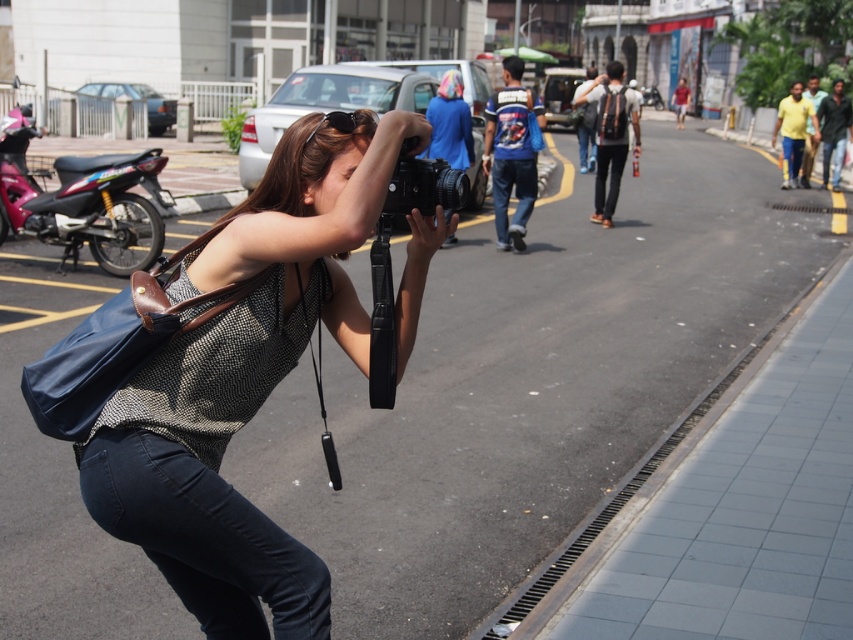
Question: Based on their relative distances, which object is farther from the black plastic sunglasses at center?

Choices:
 (A) black matte camera at center
 (B) metallic glossy motorcycle at left

Answer: (B)

Question: Which point is farther to the camera?

Choices:
 (A) black matte camera at center
 (B) black plastic sunglasses at center
 (C) matte black camera at center

Answer: (B)

Question: Is black matte camera at center thinner than black plastic sunglasses at center?

Choices:
 (A) yes
 (B) no

Answer: (B)

Question: Does black matte camera at center have a smaller size compared to black plastic sunglasses at center?

Choices:
 (A) yes
 (B) no

Answer: (B)

Question: Is black matte camera at center thinner than black plastic sunglasses at center?

Choices:
 (A) yes
 (B) no

Answer: (B)

Question: Which is farther from the black plastic sunglasses at center?

Choices:
 (A) matte black camera at center
 (B) metallic glossy motorcycle at left
 (C) black matte camera at center

Answer: (B)